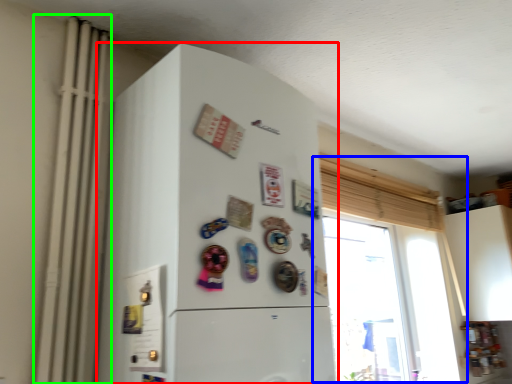
Question: Considering the real-world distances, which object is farthest from refrigerator (highlighted by a red box)? window (highlighted by a blue box) or radiator (highlighted by a green box)?

Choices:
 (A) window
 (B) radiator

Answer: (A)